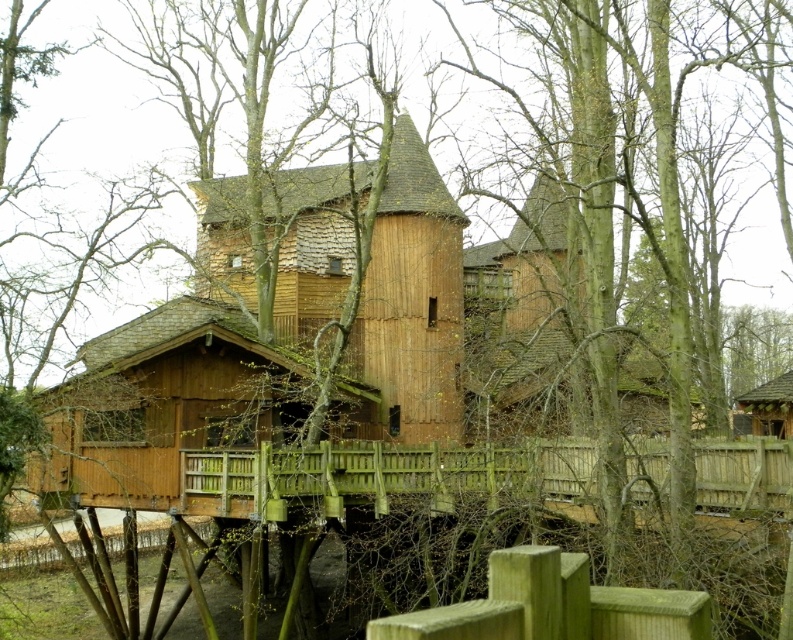
You are standing at the base of the wooden structure and want to take a photo of the wooden cabin at center without the green rough wooden post at lower center blocking the view. Which direction should you move to ensure the post is out of frame?

You should move to the side of the wooden cabin at center so that the green rough wooden post at lower center is no longer blocking the view. Since the green rough wooden post at lower center is behind the wooden cabin at center, moving to the side would position the cabin between you and the post, keeping it out of the frame.

Consider the image. You are standing in a forest and see two wooden huts. The wooden hut at center and the wooden hut at right. Which one is taller?

The wooden hut at center is taller than the wooden hut at right.

What are the coordinates of the wooden hut at center in the image?

The wooden hut at center is located at coordinates point (412,298).